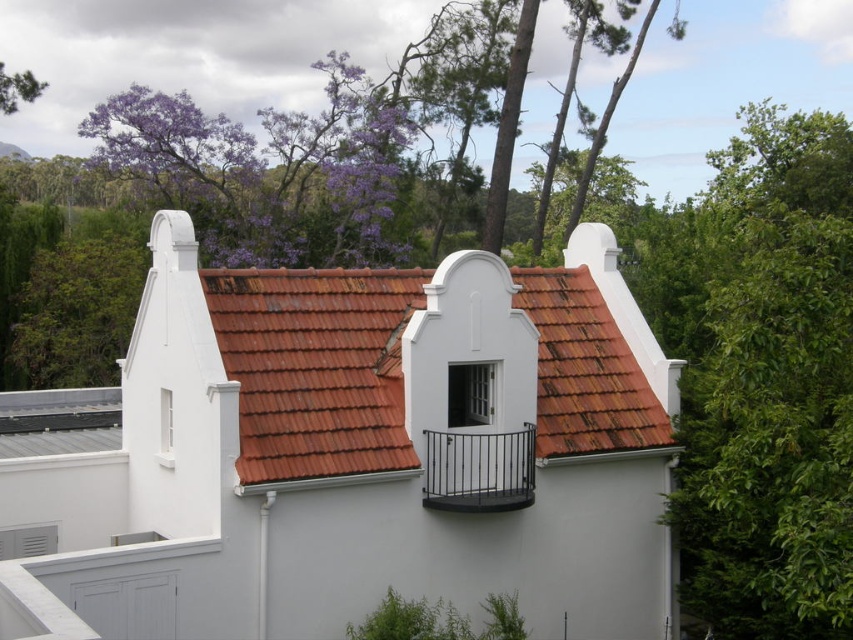
Who is shorter, white matte balcony at upper center or black metal balcony at center?

Standing shorter between the two is black metal balcony at center.

Which is more to the right, white matte balcony at upper center or black metal balcony at center?

From the viewer's perspective, black metal balcony at center appears more on the right side.

Which is behind, point (589, 444) or point (471, 486)?

The point (589, 444) is more distant.

Where is `white matte balcony at upper center`? white matte balcony at upper center is located at coordinates pyautogui.click(x=344, y=452).

Is white matte balcony at upper center below green leafy tree at right?

Yes, white matte balcony at upper center is below green leafy tree at right.

Who is more distant from viewer, (19, 545) or (770, 371)?

The point (19, 545) is behind.

This screenshot has width=853, height=640. In order to click on white matte balcony at upper center in this screenshot , I will do (x=344, y=452).

Is green leafy tree at right to the left of purple leafy tree at upper left from the viewer's perspective?

In fact, green leafy tree at right is to the right of purple leafy tree at upper left.

Is green leafy tree at right smaller than purple leafy tree at upper left?

No, green leafy tree at right is not smaller than purple leafy tree at upper left.

This screenshot has width=853, height=640. What do you see at coordinates (764, 378) in the screenshot? I see `green leafy tree at right` at bounding box center [764, 378].

Find the location of a particular element. Image resolution: width=853 pixels, height=640 pixels. green leafy tree at right is located at coordinates 764,378.